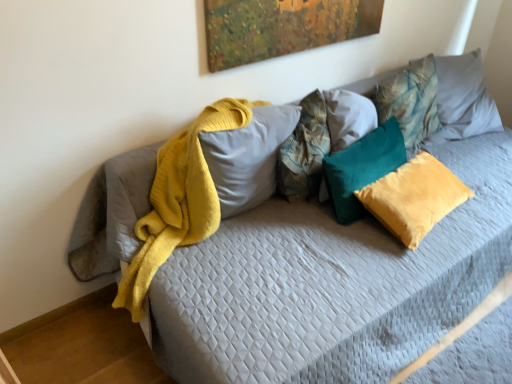
Question: Is teal velvet pillow at center, the third pillow positioned from the left, further to camera compared to soft yellow fabric pillow at center, the 1th pillow from the left?

Choices:
 (A) no
 (B) yes

Answer: (B)

Question: Is teal velvet pillow at center, acting as the 3th pillow starting from the right, next to soft yellow fabric pillow at center, the 1th pillow from the left?

Choices:
 (A) yes
 (B) no

Answer: (B)

Question: Considering the relative sizes of teal velvet pillow at center, acting as the 3th pillow starting from the right, and soft yellow fabric pillow at center, the 1th pillow from the left, in the image provided, is teal velvet pillow at center, acting as the 3th pillow starting from the right, bigger than soft yellow fabric pillow at center, the 1th pillow from the left,?

Choices:
 (A) yes
 (B) no

Answer: (B)

Question: Is teal velvet pillow at center, the third pillow positioned from the left, turned away from soft yellow fabric pillow at center, which ranks as the fifth pillow in right-to-left order?

Choices:
 (A) yes
 (B) no

Answer: (B)

Question: Is teal velvet pillow at center, the third pillow positioned from the left, positioned before soft yellow fabric pillow at center, the 1th pillow from the left?

Choices:
 (A) no
 (B) yes

Answer: (A)

Question: Is teal velvet pillow at center, which is the 2th pillow in right-to-left order, wider or thinner than soft yellow fabric pillow at center, which ranks as the fifth pillow in right-to-left order?

Choices:
 (A) wide
 (B) thin

Answer: (A)

Question: Looking at the image, does teal velvet pillow at center, which is the fourth pillow in left-to-right order, seem bigger or smaller compared to soft yellow fabric pillow at center, which ranks as the fifth pillow in right-to-left order?

Choices:
 (A) big
 (B) small

Answer: (B)

Question: From a real-world perspective, relative to soft yellow fabric pillow at center, which ranks as the fifth pillow in right-to-left order, is teal velvet pillow at center, which is the 2th pillow in right-to-left order, vertically above or below?

Choices:
 (A) below
 (B) above

Answer: (A)

Question: Relative to soft yellow fabric pillow at center, the 1th pillow from the left, is teal velvet pillow at center, which is the fourth pillow in left-to-right order, in front or behind?

Choices:
 (A) front
 (B) behind

Answer: (B)

Question: Considering their positions, is teal velvet pillow at center, the third pillow positioned from the left, located in front of or behind teal velvet pillow at upper right, marked as the 5th pillow in a left-to-right arrangement?

Choices:
 (A) front
 (B) behind

Answer: (A)

Question: From the image's perspective, is teal velvet pillow at center, the third pillow positioned from the left, located above or below teal velvet pillow at upper right, positioned as the 1th pillow in right-to-left order?

Choices:
 (A) above
 (B) below

Answer: (B)

Question: Based on their sizes in the image, would you say teal velvet pillow at center, the third pillow positioned from the left, is bigger or smaller than teal velvet pillow at upper right, positioned as the 1th pillow in right-to-left order?

Choices:
 (A) small
 (B) big

Answer: (A)

Question: Considering the positions of point (364, 165) and point (424, 99), is point (364, 165) closer or farther from the camera than point (424, 99)?

Choices:
 (A) closer
 (B) farther

Answer: (A)

Question: Is teal velvet pillow at upper right, marked as the 5th pillow in a left-to-right arrangement, wider or thinner than teal velvet pillow at center, the third pillow positioned from the left?

Choices:
 (A) wide
 (B) thin

Answer: (A)

Question: From the image's perspective, relative to teal velvet pillow at center, the third pillow positioned from the left, is teal velvet pillow at upper right, marked as the 5th pillow in a left-to-right arrangement, above or below?

Choices:
 (A) above
 (B) below

Answer: (A)